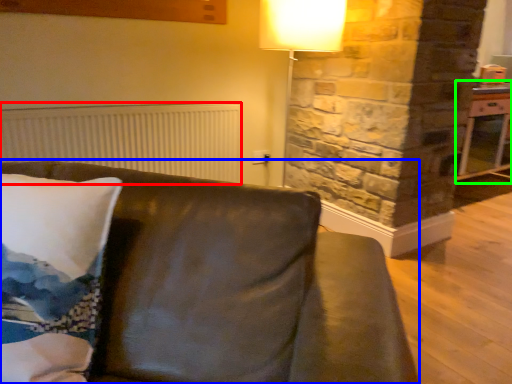
Question: Which is nearer to the radiator (highlighted by a red box)? studio couch (highlighted by a blue box) or table (highlighted by a green box).

Choices:
 (A) studio couch
 (B) table

Answer: (A)